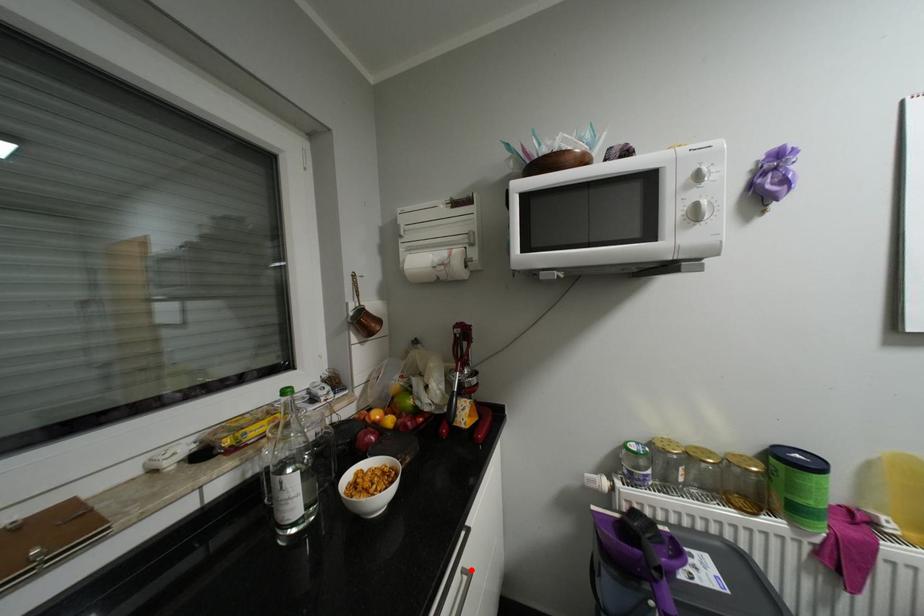
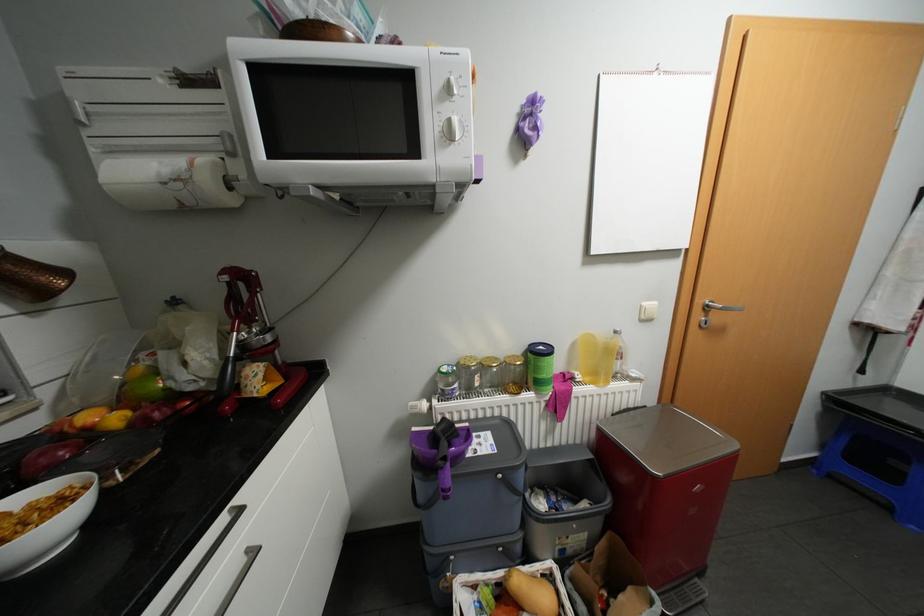
Find the pixel in the second image that matches the highlighted location in the first image.

(256, 549)